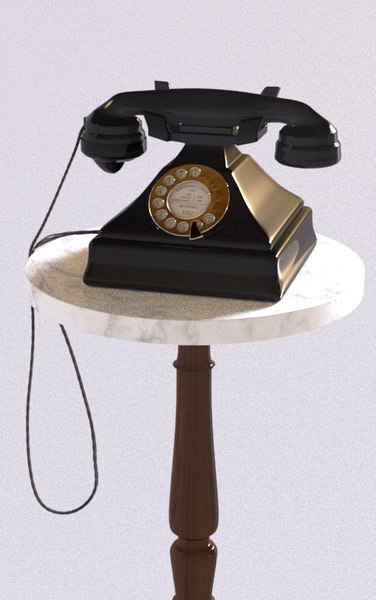
Where is `phone stand`? This screenshot has width=376, height=600. phone stand is located at coordinates (196, 334), (194, 485).